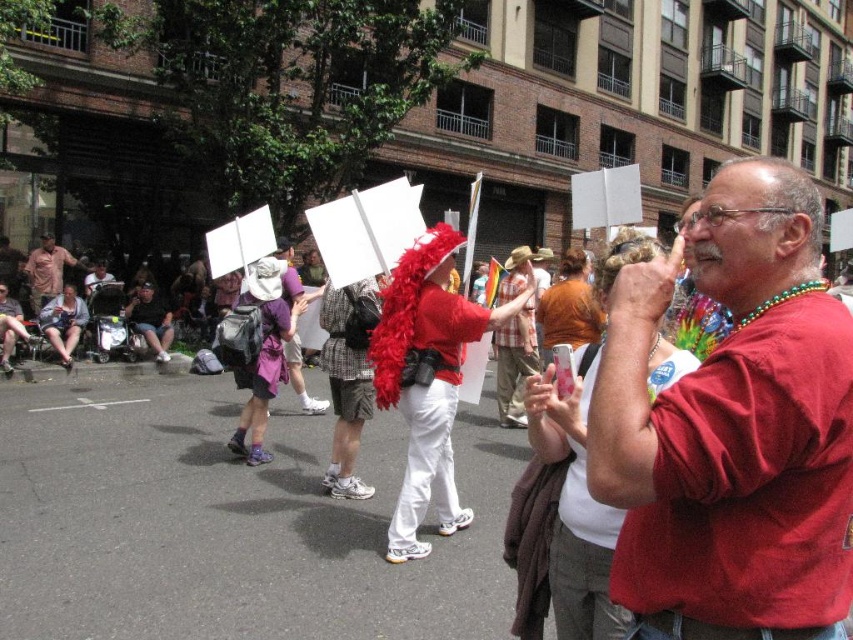
The height and width of the screenshot is (640, 853). What are the coordinates of `feather boa at center` in the screenshot? It's located at (427, 378).

Is feather boa at center to the right of matte pink shirt at center from the viewer's perspective?

Correct, you'll find feather boa at center to the right of matte pink shirt at center.

Is point (401, 403) positioned in front of point (48, 273)?

Yes, it is.

The width and height of the screenshot is (853, 640). Find the location of `feather boa at center`. feather boa at center is located at coordinates (427, 378).

Where is `matte red shirt at center`? matte red shirt at center is located at coordinates (733, 428).

Is point (708, 515) closer to viewer compared to point (453, 328)?

That is True.

The image size is (853, 640). Find the location of `matte red shirt at center`. matte red shirt at center is located at coordinates (733, 428).

Who is shorter, feather boa at center or purple fabric hat at center?

With less height is purple fabric hat at center.

Who is taller, feather boa at center or purple fabric hat at center?

Standing taller between the two is feather boa at center.

Find the location of a particular element. feather boa at center is located at coordinates (427, 378).